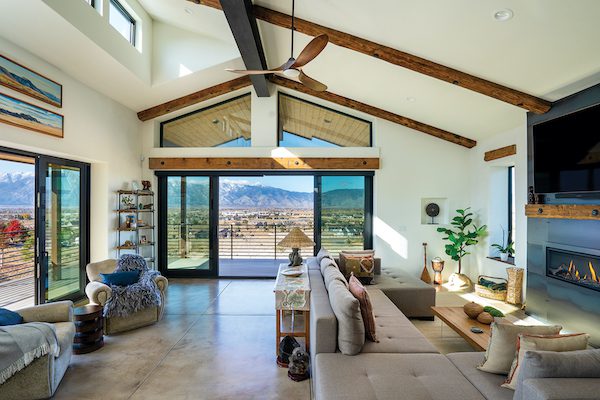
This screenshot has height=400, width=600. What are the coordinates of `fan on ceiling` in the screenshot? It's located at (318, 49).